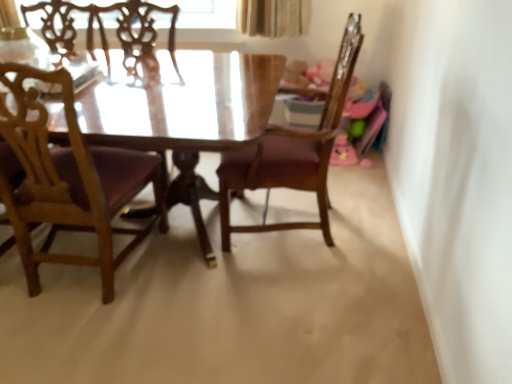
Identify the location of wooden chair at left, the 2th chair positioned from the right. (69, 180).

What do you see at coordinates (69, 180) in the screenshot? The height and width of the screenshot is (384, 512). I see `wooden chair at left, the 2th chair positioned from the right` at bounding box center [69, 180].

Measure the distance between point (56,178) and camera.

Point (56,178) is 5.20 feet away from camera.

In order to face wooden chair at center, which is the 1th chair in right-to-left order, should I rotate leftwards or rightwards?

A 3.988 degree turn to the right will do.

What do you see at coordinates (292, 152) in the screenshot? I see `wooden chair at center, which is the 1th chair in right-to-left order` at bounding box center [292, 152].

The height and width of the screenshot is (384, 512). I want to click on wooden chair at center, which is the 1th chair in right-to-left order, so click(292, 152).

The image size is (512, 384). I want to click on wooden chair at left, the 2th chair positioned from the right, so click(x=69, y=180).

Between wooden chair at center, which is the 1th chair in right-to-left order, and wooden chair at left, the 1th chair from the left, which one appears on the right side from the viewer's perspective?

wooden chair at center, which is the 1th chair in right-to-left order, is more to the right.

Which object is closer to the camera, wooden chair at center, which is the 1th chair in right-to-left order, or wooden chair at left, the 1th chair from the left?

wooden chair at left, the 1th chair from the left, is in front.

Does point (325, 162) come farther from viewer compared to point (36, 75)?

Yes, it is behind point (36, 75).

From the image's perspective, which one is positioned higher, wooden chair at center, which is the 1th chair in right-to-left order, or wooden chair at left, the 2th chair positioned from the right?

wooden chair at center, which is the 1th chair in right-to-left order, from the image's perspective.

From a real-world perspective, which is physically below, wooden chair at center, which is the 1th chair in right-to-left order, or wooden chair at left, the 2th chair positioned from the right?

From a 3D spatial view, wooden chair at left, the 2th chair positioned from the right, is below.

Does wooden chair at center, the second chair when ordered from left to right, have a lesser width compared to wooden chair at left, the 2th chair positioned from the right?

Indeed, wooden chair at center, the second chair when ordered from left to right, has a lesser width compared to wooden chair at left, the 2th chair positioned from the right.

Is wooden chair at center, which is the 1th chair in right-to-left order, taller or shorter than wooden chair at left, the 2th chair positioned from the right?

In the image, wooden chair at center, which is the 1th chair in right-to-left order, appears to be taller than wooden chair at left, the 2th chair positioned from the right.

Is wooden chair at center, which is the 1th chair in right-to-left order, bigger or smaller than wooden chair at left, the 2th chair positioned from the right?

Clearly, wooden chair at center, which is the 1th chair in right-to-left order, is larger in size than wooden chair at left, the 2th chair positioned from the right.

Is wooden chair at center, which is the 1th chair in right-to-left order, positioned beyond the bounds of wooden chair at left, the 1th chair from the left?

That's correct, wooden chair at center, which is the 1th chair in right-to-left order, is outside of wooden chair at left, the 1th chair from the left.

Is there a large distance between wooden chair at center, which is the 1th chair in right-to-left order, and wooden chair at left, the 1th chair from the left?

They are positioned close to each other.

Is wooden chair at center, which is the 1th chair in right-to-left order, looking in the opposite direction of wooden chair at left, the 1th chair from the left?

No.

How different are the orientations of wooden chair at center, the second chair when ordered from left to right, and wooden chair at left, the 2th chair positioned from the right, in degrees?

The angular difference between wooden chair at center, the second chair when ordered from left to right, and wooden chair at left, the 2th chair positioned from the right, is 93.3 degrees.

Consider the image. How far apart are wooden chair at center, which is the 1th chair in right-to-left order, and wooden chair at left, the 1th chair from the left?

wooden chair at center, which is the 1th chair in right-to-left order, and wooden chair at left, the 1th chair from the left, are 24.68 inches apart from each other.

The height and width of the screenshot is (384, 512). Find the location of `chair that is above the wooden chair at left, the 2th chair positioned from the right (from the image's perspective)`. chair that is above the wooden chair at left, the 2th chair positioned from the right (from the image's perspective) is located at coordinates (292, 152).

In the image, is wooden chair at left, the 2th chair positioned from the right, on the left side or the right side of wooden chair at center, the second chair when ordered from left to right?

wooden chair at left, the 2th chair positioned from the right, is positioned on wooden chair at center, the second chair when ordered from left to right,'s left side.

Is the depth of wooden chair at left, the 1th chair from the left, less than that of wooden chair at center, which is the 1th chair in right-to-left order?

Yes, it is in front of wooden chair at center, which is the 1th chair in right-to-left order.

Considering the positions of point (106, 300) and point (230, 154), is point (106, 300) closer or farther from the camera than point (230, 154)?

Point (106, 300) appears to be closer to the viewer than point (230, 154).

From the image's perspective, which one is positioned lower, wooden chair at left, the 1th chair from the left, or wooden chair at center, the second chair when ordered from left to right?

wooden chair at left, the 1th chair from the left.

From a real-world perspective, between wooden chair at left, the 2th chair positioned from the right, and wooden chair at center, the second chair when ordered from left to right, who is vertically higher?

From a 3D spatial view, wooden chair at center, the second chair when ordered from left to right, is above.

Is wooden chair at left, the 1th chair from the left, wider or thinner than wooden chair at center, which is the 1th chair in right-to-left order?

In the image, wooden chair at left, the 1th chair from the left, appears to be wider than wooden chair at center, which is the 1th chair in right-to-left order.

Is wooden chair at left, the 2th chair positioned from the right, taller or shorter than wooden chair at center, the second chair when ordered from left to right?

In the image, wooden chair at left, the 2th chair positioned from the right, appears to be shorter than wooden chair at center, the second chair when ordered from left to right.

Between wooden chair at left, the 2th chair positioned from the right, and wooden chair at center, which is the 1th chair in right-to-left order, which one has smaller size?

wooden chair at left, the 2th chair positioned from the right, is smaller.

Is wooden chair at left, the 1th chair from the left, not within wooden chair at center, which is the 1th chair in right-to-left order?

Yes, wooden chair at left, the 1th chair from the left, is outside of wooden chair at center, which is the 1th chair in right-to-left order.

Does wooden chair at left, the 1th chair from the left, touch wooden chair at center, the second chair when ordered from left to right?

They are not placed beside each other.

Does wooden chair at left, the 2th chair positioned from the right, turn towards wooden chair at center, the second chair when ordered from left to right?

No.

The image size is (512, 384). I want to click on chair that appears above the wooden chair at left, the 2th chair positioned from the right (from a real-world perspective), so pos(292,152).

Locate an element on the screen. The image size is (512, 384). chair on the right of the wooden chair at left, the 2th chair positioned from the right is located at coordinates (292, 152).

Locate an element on the screen. This screenshot has width=512, height=384. chair above the wooden chair at left, the 2th chair positioned from the right (from a real-world perspective) is located at coordinates (292, 152).